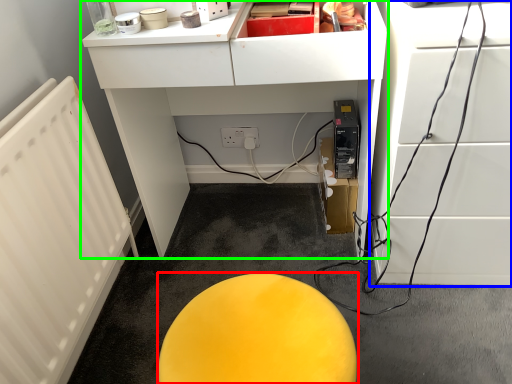
Question: Based on their relative distances, which object is farther from furniture (highlighted by a red box)? Choose from furniture (highlighted by a blue box) and furniture (highlighted by a green box).

Choices:
 (A) furniture
 (B) furniture

Answer: (B)